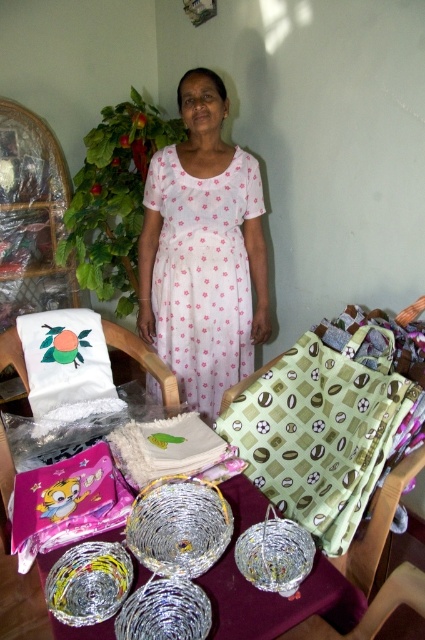
Question: Can you confirm if white floral dress at center is thinner than white embroidered pillow at left?

Choices:
 (A) yes
 (B) no

Answer: (B)

Question: Where is white floral dress at center located in relation to white embroidered pillow at left in the image?

Choices:
 (A) above
 (B) below

Answer: (A)

Question: Is white floral dress at center further to the viewer compared to woven metallic basket at center?

Choices:
 (A) yes
 (B) no

Answer: (A)

Question: Which point appears farthest from the camera in this image?

Choices:
 (A) (283, 458)
 (B) (209, 401)

Answer: (B)

Question: Which point is closer to the camera?

Choices:
 (A) white embroidered pillow at left
 (B) green printed fabric at center
 (C) white floral dress at center

Answer: (B)

Question: Which object appears closest to the camera in this image?

Choices:
 (A) white floral dress at center
 (B) green printed fabric at center
 (C) white embroidered pillow at left

Answer: (B)